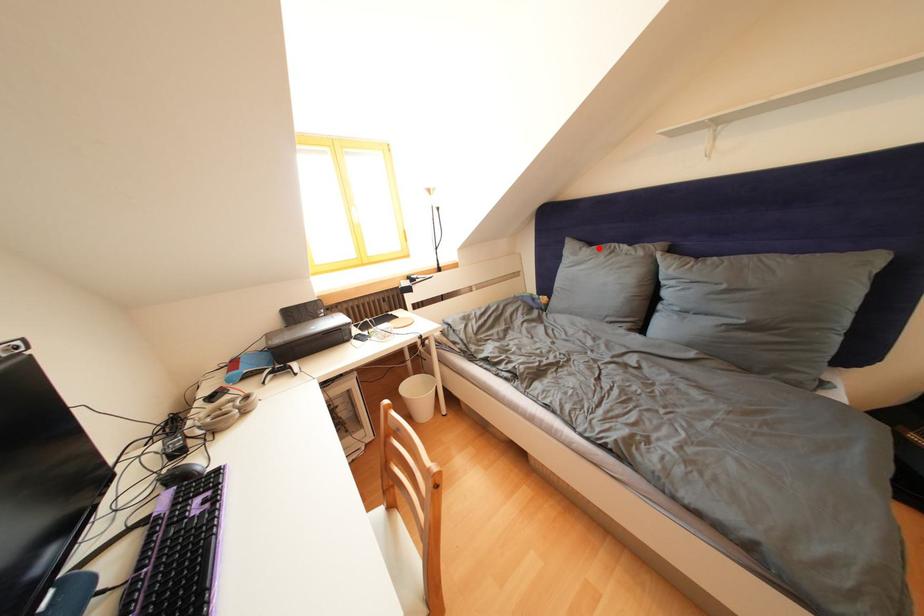
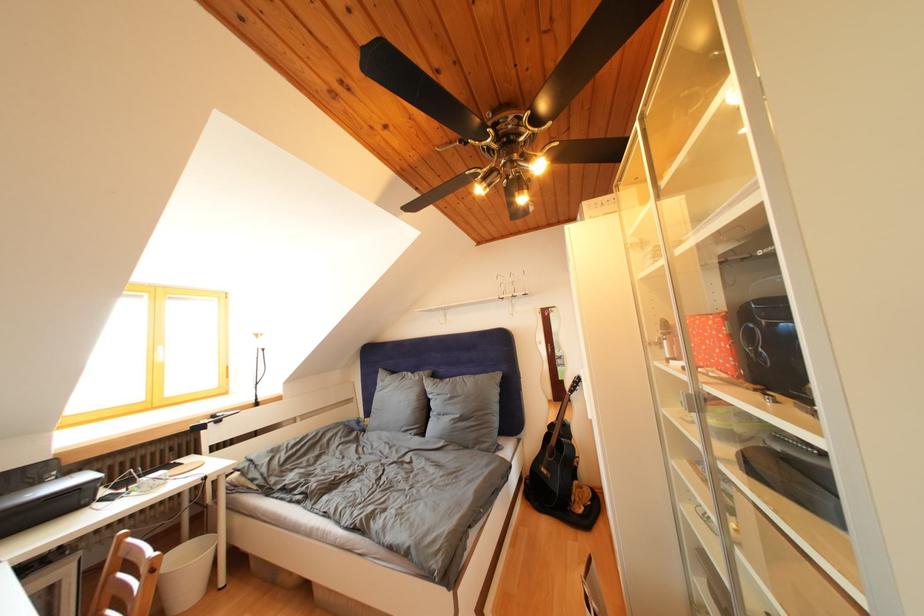
In the second image, find the point that corresponds to the highlighted location in the first image.

(400, 378)